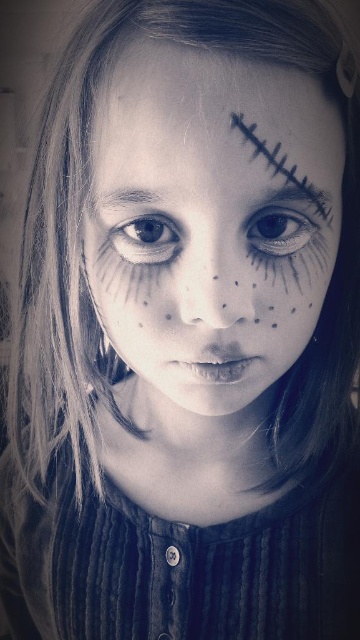
Between black matte eyebrow at upper center and matte black eye at center, which one is positioned lower?

matte black eye at center

Who is taller, black matte eyebrow at upper center or matte black eye at center?

black matte eyebrow at upper center

The image size is (360, 640). What do you see at coordinates (285, 170) in the screenshot?
I see `black matte eyebrow at upper center` at bounding box center [285, 170].

Locate an element on the screen. black matte eyebrow at upper center is located at coordinates (285, 170).

Who is taller, matte black face paint at center or black matte eyebrow at upper center?

With more height is matte black face paint at center.

Who is shorter, matte black face paint at center or black matte eyebrow at upper center?

Standing shorter between the two is black matte eyebrow at upper center.

Find the location of a particular element. The width and height of the screenshot is (360, 640). matte black face paint at center is located at coordinates (212, 218).

Describe the element at coordinates (285, 170) in the screenshot. I see `black matte eyebrow at upper center` at that location.

Is black matte eyebrow at upper center bigger than brown matte eye at center?

Yes.

Find the location of a particular element. The width and height of the screenshot is (360, 640). black matte eyebrow at upper center is located at coordinates (285, 170).